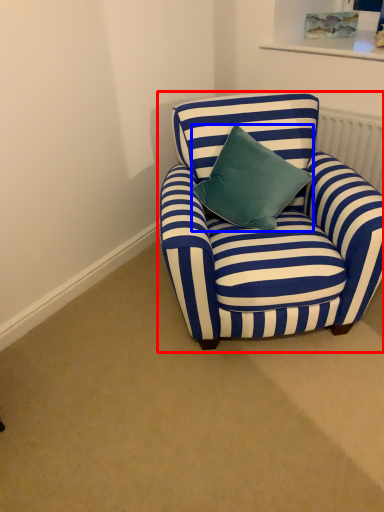
Question: Which object appears farthest to the camera in this image, chair (highlighted by a red box) or pillow (highlighted by a blue box)?

Choices:
 (A) chair
 (B) pillow

Answer: (B)